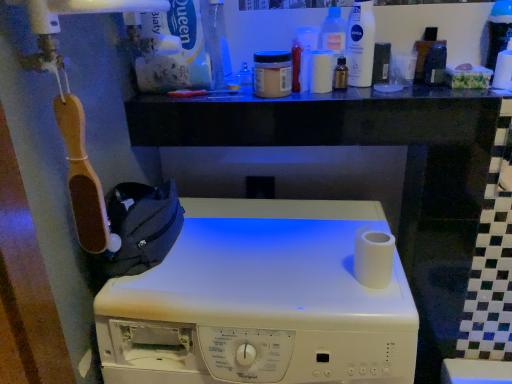
The height and width of the screenshot is (384, 512). In order to click on free point to the left of white matte toilet paper at right, the second toilet paper positioned from the back in this screenshot , I will do point(290,273).